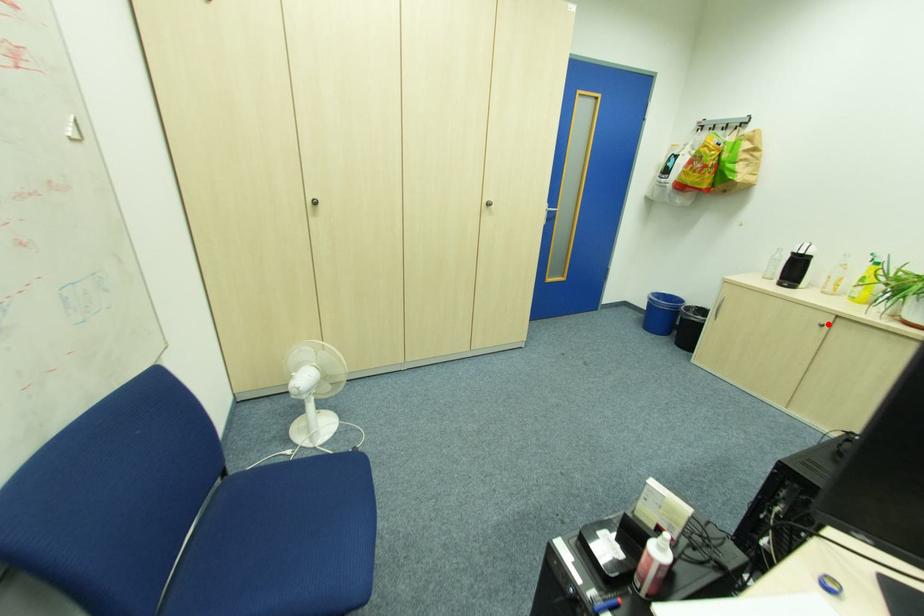
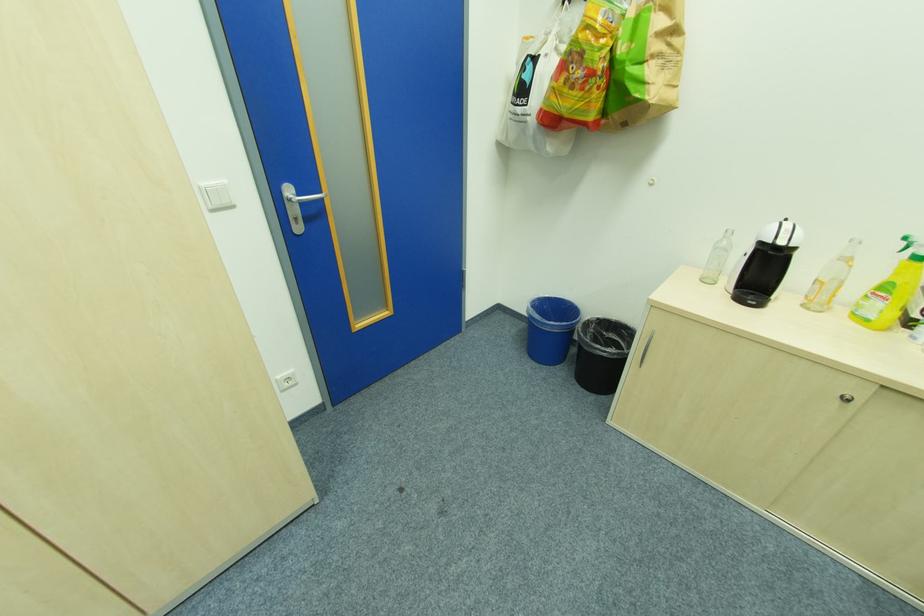
Question: I am providing you with two images of the same scene from different viewpoints. A red point is marked on the first image. Is the red point's position out of view in image 2?

Choices:
 (A) Yes
 (B) No

Answer: (B)